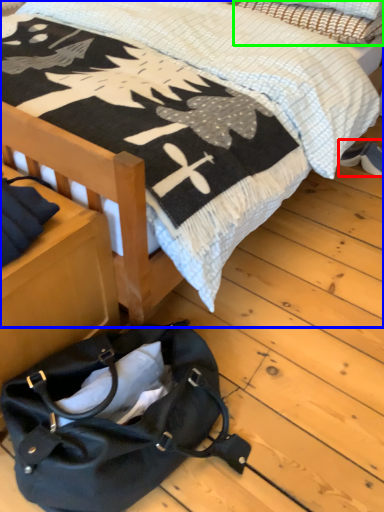
Question: Which object is positioned closest to footwear (highlighted by a red box)? Select from bed (highlighted by a blue box) and pillow (highlighted by a green box).

Choices:
 (A) bed
 (B) pillow

Answer: (B)